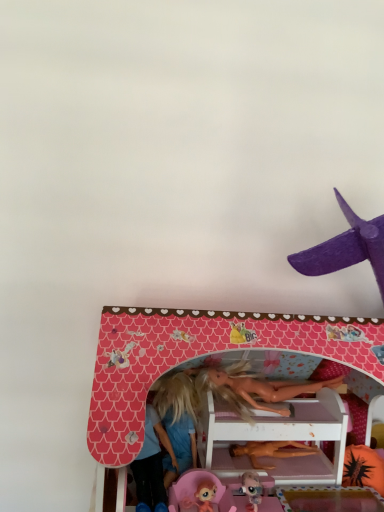
Describe the element at coordinates (192, 357) in the screenshot. I see `pink matte dollhouse at center` at that location.

Image resolution: width=384 pixels, height=512 pixels. What are the coordinates of `pink matte dollhouse at center` in the screenshot? It's located at (192, 357).

You are a GUI agent. You are given a task and a screenshot of the screen. Output one action in this format:
    pyautogui.click(x=<x>, y=<y>)
    Task: Click on the pink matte dollhouse at center
    Image resolution: width=384 pixels, height=512 pixels.
    Given the screenshot: What is the action you would take?
    pyautogui.click(x=192, y=357)